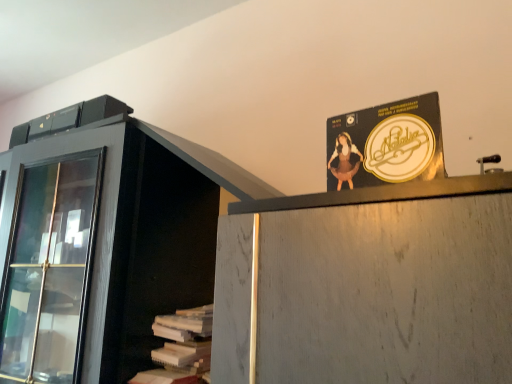
In order to click on gold metallic record album at upper center in this screenshot , I will do [x=386, y=144].

The height and width of the screenshot is (384, 512). What do you see at coordinates (386, 144) in the screenshot? I see `gold metallic record album at upper center` at bounding box center [386, 144].

Measure the distance between point (179, 352) and camera.

Point (179, 352) and camera are 38.23 inches apart from each other.

This screenshot has width=512, height=384. What do you see at coordinates (181, 347) in the screenshot?
I see `white paper stack at lower left` at bounding box center [181, 347].

The image size is (512, 384). In order to click on white paper stack at lower left in this screenshot , I will do pyautogui.click(x=181, y=347).

Measure the distance between white paper stack at lower left and camera.

A distance of 36.57 inches exists between white paper stack at lower left and camera.

Locate an element on the screen. gold metallic record album at upper center is located at coordinates (386, 144).

Is white paper stack at lower left to the left of gold metallic record album at upper center from the viewer's perspective?

Yes.

Which object is more forward, white paper stack at lower left or gold metallic record album at upper center?

gold metallic record album at upper center.

Considering the positions of point (173, 321) and point (397, 166), is point (173, 321) closer or farther from the camera than point (397, 166)?

Point (173, 321) appears to be farther away from the viewer than point (397, 166).

From the image's perspective, which object appears higher, white paper stack at lower left or gold metallic record album at upper center?

From the image's view, gold metallic record album at upper center is above.

From a real-world perspective, which is physically below, white paper stack at lower left or gold metallic record album at upper center?

white paper stack at lower left.

Considering the sizes of white paper stack at lower left and gold metallic record album at upper center in the image, is white paper stack at lower left wider or thinner than gold metallic record album at upper center?

white paper stack at lower left is wider than gold metallic record album at upper center.

Considering the sizes of objects white paper stack at lower left and gold metallic record album at upper center in the image provided, who is shorter, white paper stack at lower left or gold metallic record album at upper center?

Standing shorter between the two is gold metallic record album at upper center.

Consider the image. Between white paper stack at lower left and gold metallic record album at upper center, which one has larger size?

With larger size is white paper stack at lower left.

Is white paper stack at lower left not within gold metallic record album at upper center?

Yes, white paper stack at lower left is not within gold metallic record album at upper center.

Are white paper stack at lower left and gold metallic record album at upper center located far from each other?

They are positioned close to each other.

Is white paper stack at lower left positioned with its back to gold metallic record album at upper center?

No, white paper stack at lower left's orientation is not away from gold metallic record album at upper center.

Can you tell me how much white paper stack at lower left and gold metallic record album at upper center differ in facing direction?

white paper stack at lower left and gold metallic record album at upper center are facing 0.00023 degrees away from each other.

You are a GUI agent. You are given a task and a screenshot of the screen. Output one action in this format:
    pyautogui.click(x=<x>, y=<y>)
    Task: Click on the advertisement above the white paper stack at lower left (from a real-world perspective)
    The image size is (512, 384).
    Given the screenshot: What is the action you would take?
    pyautogui.click(x=386, y=144)

Considering the relative positions of gold metallic record album at upper center and white paper stack at lower left in the image provided, is gold metallic record album at upper center to the right of white paper stack at lower left from the viewer's perspective?

Correct, you'll find gold metallic record album at upper center to the right of white paper stack at lower left.

Which object is closer to the camera, gold metallic record album at upper center or white paper stack at lower left?

gold metallic record album at upper center is more forward.

Is point (336, 187) less distant than point (191, 347)?

Yes, it is in front of point (191, 347).

From the image's perspective, between gold metallic record album at upper center and white paper stack at lower left, who is located below?

white paper stack at lower left.

From a real-world perspective, is gold metallic record album at upper center beneath white paper stack at lower left?

No, from a real-world perspective, gold metallic record album at upper center is not under white paper stack at lower left.

Is gold metallic record album at upper center wider than white paper stack at lower left?

Incorrect, the width of gold metallic record album at upper center does not surpass that of white paper stack at lower left.

Considering the relative sizes of gold metallic record album at upper center and white paper stack at lower left in the image provided, is gold metallic record album at upper center taller than white paper stack at lower left?

No, gold metallic record album at upper center is not taller than white paper stack at lower left.

Which of these two, gold metallic record album at upper center or white paper stack at lower left, is smaller?

With smaller size is gold metallic record album at upper center.

Is gold metallic record album at upper center completely or partially outside of white paper stack at lower left?

Indeed, gold metallic record album at upper center is completely outside white paper stack at lower left.

Is gold metallic record album at upper center with white paper stack at lower left?

No, gold metallic record album at upper center is not with white paper stack at lower left.

Is gold metallic record album at upper center looking in the opposite direction of white paper stack at lower left?

No, gold metallic record album at upper center is not facing away from white paper stack at lower left.

How many degrees apart are the facing directions of gold metallic record album at upper center and white paper stack at lower left?

0.00023 degrees separate the facing orientations of gold metallic record album at upper center and white paper stack at lower left.

The width and height of the screenshot is (512, 384). I want to click on advertisement that is on the right side of white paper stack at lower left, so click(x=386, y=144).

I want to click on advertisement above the white paper stack at lower left (from the image's perspective), so click(386, 144).

Locate an element on the screen. The width and height of the screenshot is (512, 384). advertisement on the right of white paper stack at lower left is located at coordinates (386, 144).